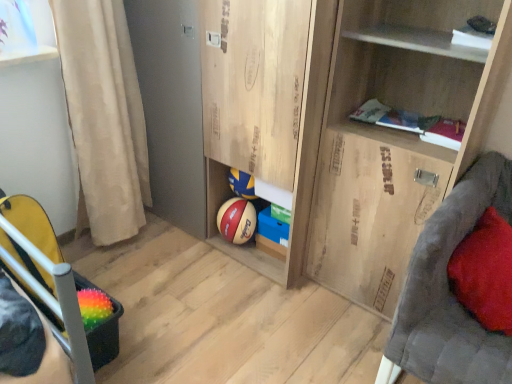
Locate an element on the screen. free location in front of beige fabric curtain at left is located at coordinates (119, 268).